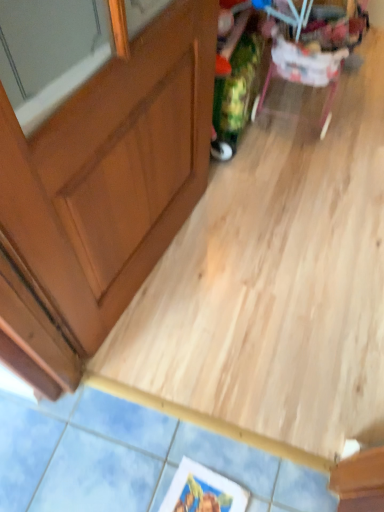
Describe the element at coordinates (202, 490) in the screenshot. This screenshot has height=512, width=384. I see `matte white picture frame at lower center` at that location.

In order to face matte white picture frame at lower center, should I rotate leftwards or rightwards?

Turn right approximately 0.137 degrees to face it.

At what (x,y) coordinates should I click in order to perform the action: click on matte white picture frame at lower center. Please return your answer as a coordinate pair (x, y). The image size is (384, 512). Looking at the image, I should click on (202, 490).

From the picture: What is the approximate width of matte white picture frame at lower center?

It is 12.32 inches.

Locate an element on the screen. matte white picture frame at lower center is located at coordinates (202, 490).